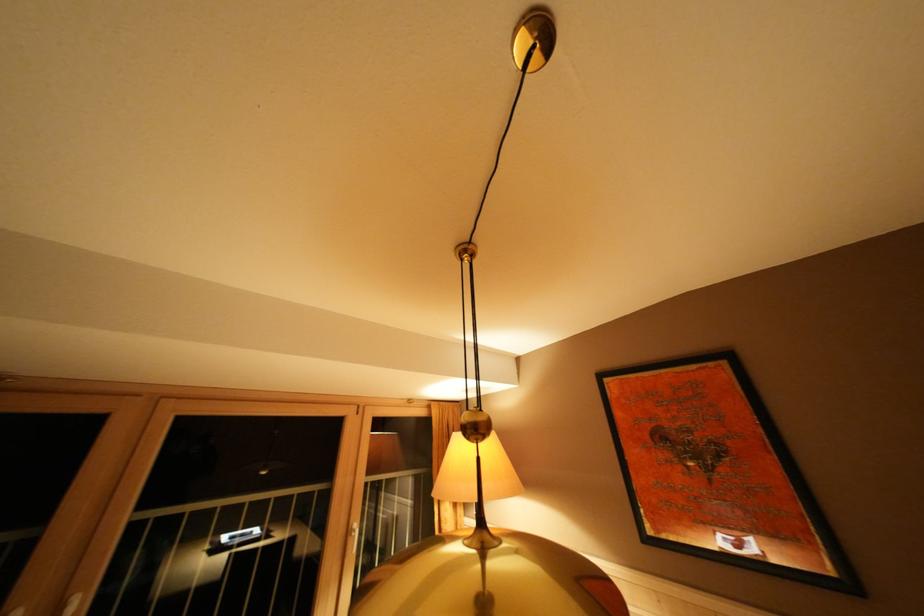
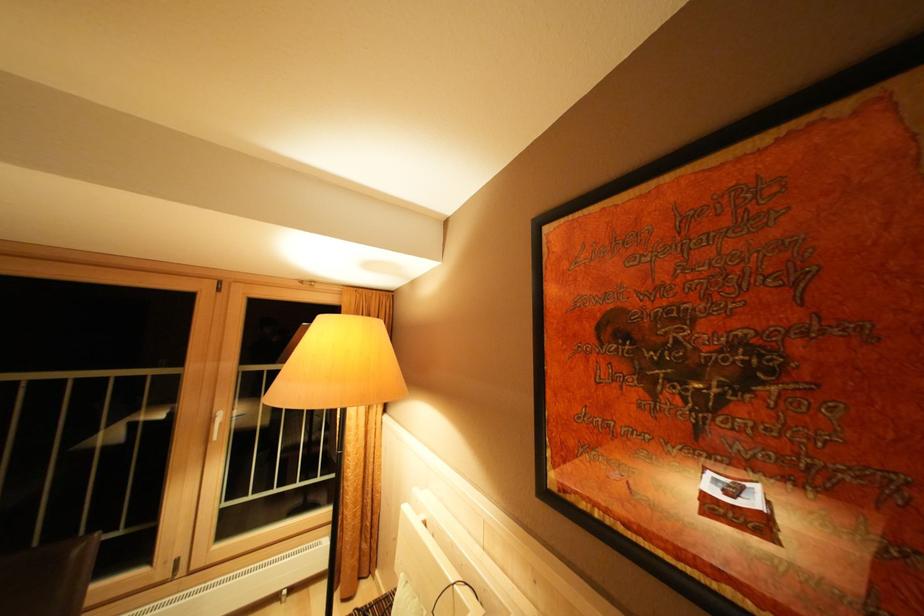
What movement of the cameraman would produce the second image?

The movement direction of the cameraman is right, forward.